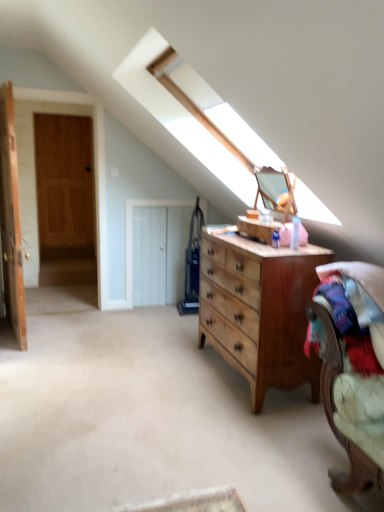
Where is `free location above white wooden door at center, positioned as the 3th door in left-to-right order (from a real-world perspective)`? free location above white wooden door at center, positioned as the 3th door in left-to-right order (from a real-world perspective) is located at coordinates (178, 195).